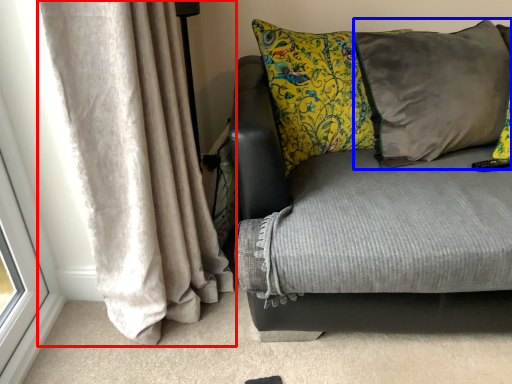
Question: Which of the following is the farthest to the observer, curtain (highlighted by a red box) or pillow (highlighted by a blue box)?

Choices:
 (A) curtain
 (B) pillow

Answer: (B)